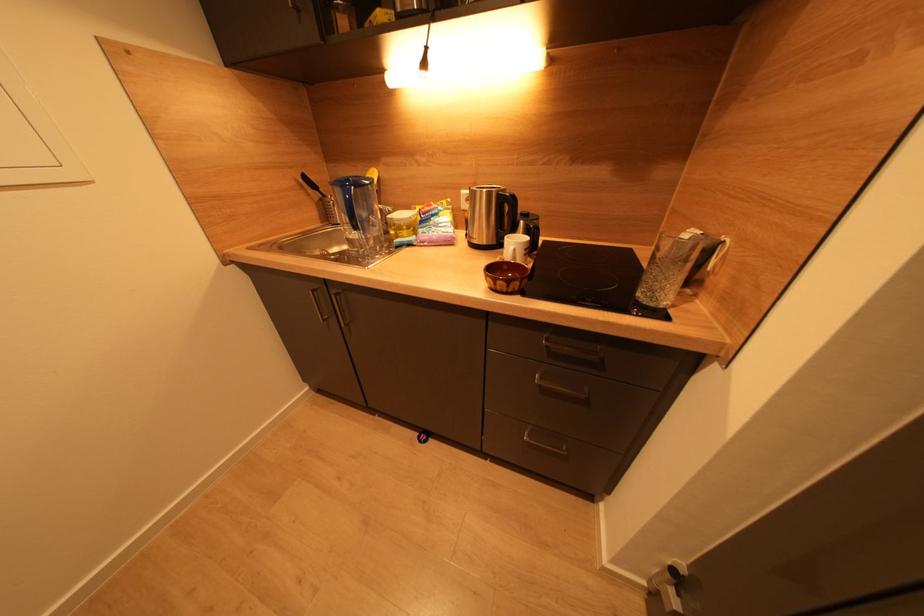
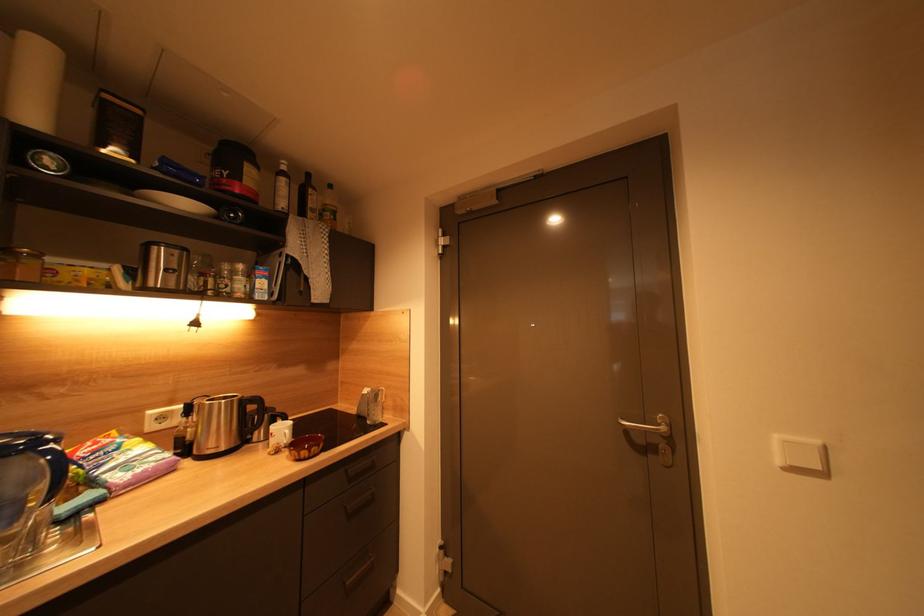
Question: The images are taken continuously from a first-person perspective. In which direction is your viewpoint rotating?

Choices:
 (A) Left
 (B) Right
 (C) Up
 (D) Down

Answer: (B)